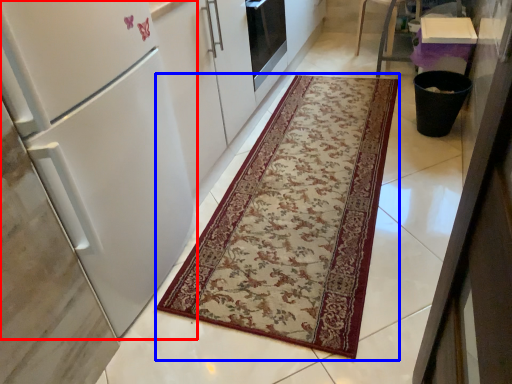
Question: Among these objects, which one is nearest to the camera, refrigerator (highlighted by a red box) or mat (highlighted by a blue box)?

Choices:
 (A) refrigerator
 (B) mat

Answer: (A)